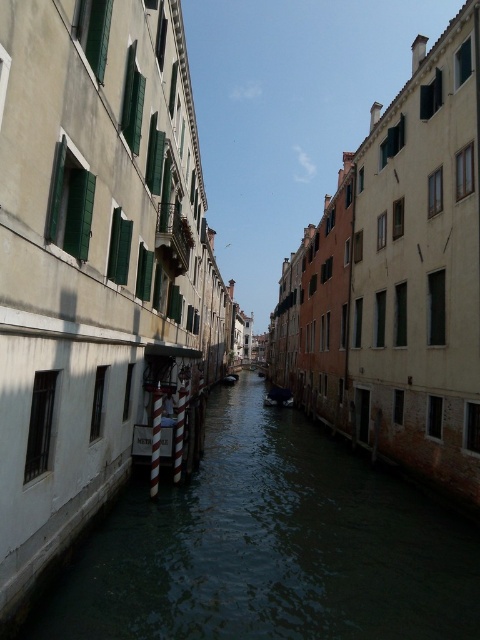
Looking at this image, you are standing at the edge of the canal and want to determine which of the two points, point (303, 560) or point (290, 397), is closer to you. Based on the scene, which point is nearer?

Point (303, 560) is closer to the viewer than point (290, 397).

You are standing on the edge of the canal in the image. There is a point marked at coordinates (x=271, y=547). What is located at that point?

The point at coordinates (x=271, y=547) indicates greenish water at center.

You are a tourist in Venice and want to take a photo of the canal. You have a camera with a fixed zoom lens that can only capture objects up to 10 meters wide. The greenish water at center and the shiny blue boat at center are both in your frame. Which object would occupy more of the photo, and why?

The greenish water at center would occupy more of the photo because it is bigger than the shiny blue boat at center according to the description.